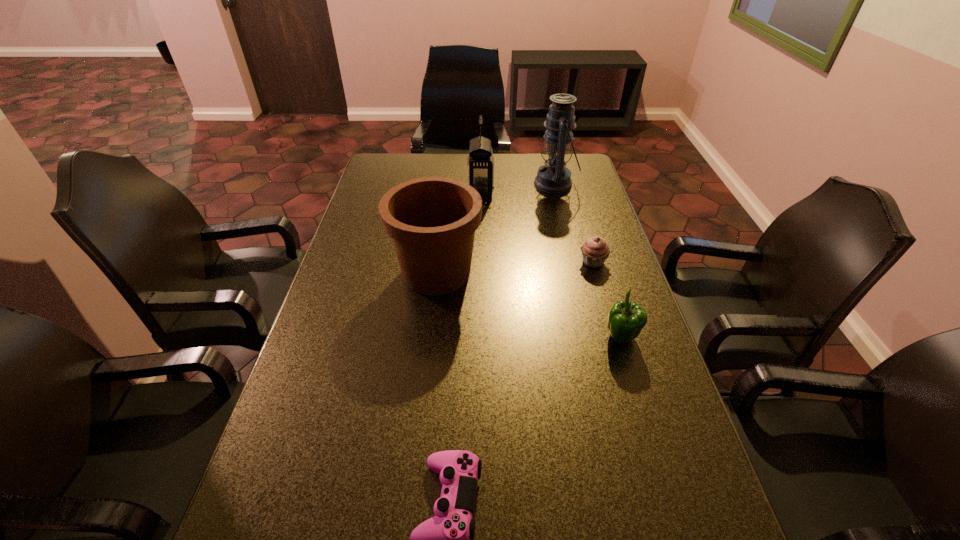
The width and height of the screenshot is (960, 540). I want to click on free space located 0.060m on the front-facing side of the shorter lantern, so click(x=452, y=193).

Image resolution: width=960 pixels, height=540 pixels. In order to click on free space located on the front-facing side of the shorter lantern in this screenshot , I will do (436, 193).

At what (x,y) coordinates should I click in order to perform the action: click on free space located on the front-facing side of the shorter lantern. Please return your answer as a coordinate pair (x, y). The image size is (960, 540). Looking at the image, I should click on (379, 193).

Locate an element on the screen. This screenshot has width=960, height=540. vacant area situated 0.100m on the back of the flowerpot is located at coordinates (442, 227).

This screenshot has width=960, height=540. Find the location of `free location located 0.060m on the back of the fourth tallest object`. free location located 0.060m on the back of the fourth tallest object is located at coordinates (612, 309).

This screenshot has height=540, width=960. Identify the location of free space located 0.100m on the back of the fifth tallest object. (585, 234).

This screenshot has width=960, height=540. Find the location of `object that is at the far edge`. object that is at the far edge is located at coordinates (x=554, y=177).

Identify the location of lantern that is at the right edge. (554, 177).

What are the coordinates of `bell pepper located in the right edge section of the desktop` in the screenshot? It's located at (626, 319).

This screenshot has width=960, height=540. Identify the location of cupcake that is at the right edge. (595, 250).